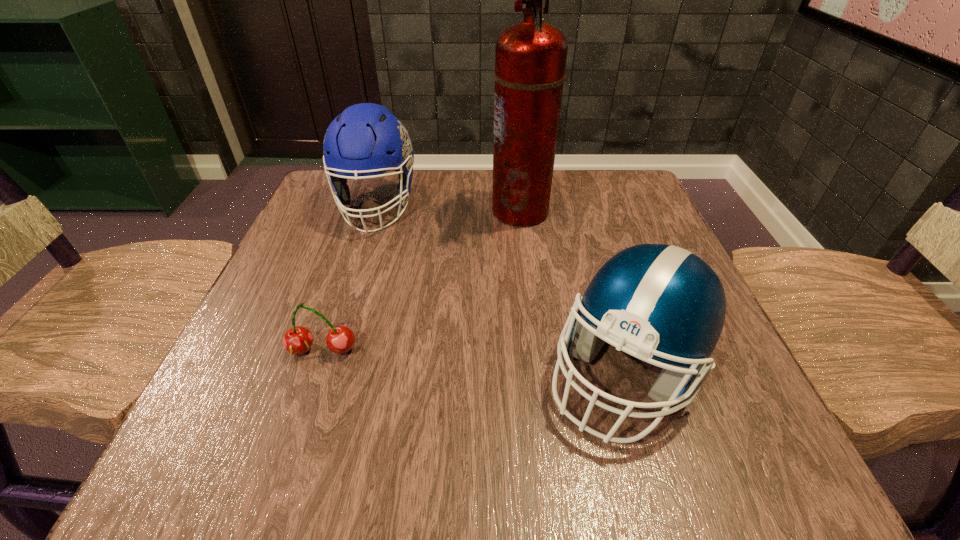
The width and height of the screenshot is (960, 540). I want to click on vacant region between the farther football helmet and the cherry, so click(x=349, y=278).

This screenshot has height=540, width=960. Find the location of `unoccupied area between the left football helmet and the cherry`. unoccupied area between the left football helmet and the cherry is located at coordinates (349, 278).

The height and width of the screenshot is (540, 960). I want to click on free space between the right football helmet and the farther football helmet, so click(501, 289).

Locate an element on the screen. Image resolution: width=960 pixels, height=540 pixels. blank region between the farther football helmet and the shortest object is located at coordinates (349, 278).

Identify the location of the second closest object to the fire extinguisher. (660, 301).

Find the location of a particular element. object identified as the closest to the farther football helmet is located at coordinates (530, 57).

The height and width of the screenshot is (540, 960). I want to click on vacant space that satisfies the following two spatial constraints: 1. on the side of the fire extinguisher with the handle and hose; 2. with stems pointing upwards on the shortest object, so click(537, 350).